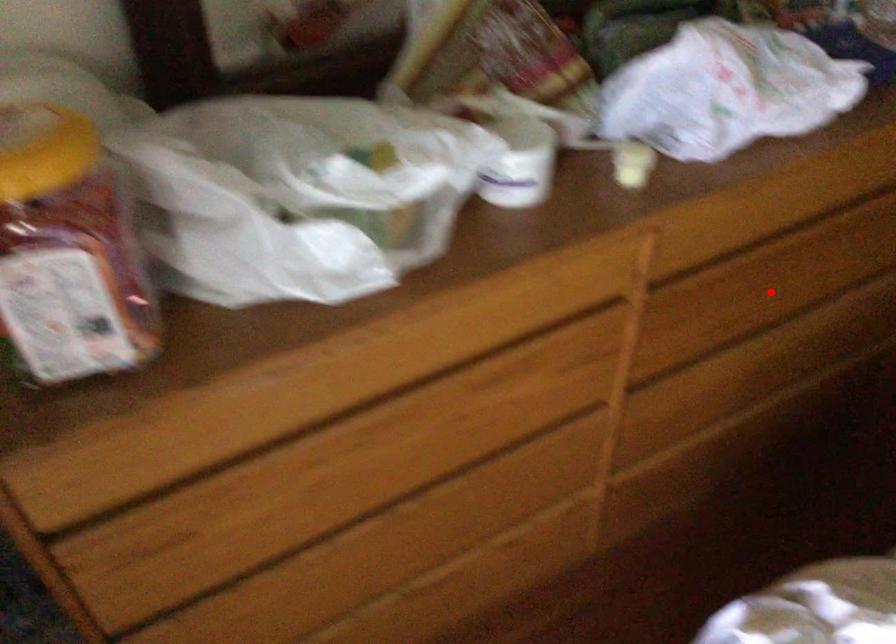
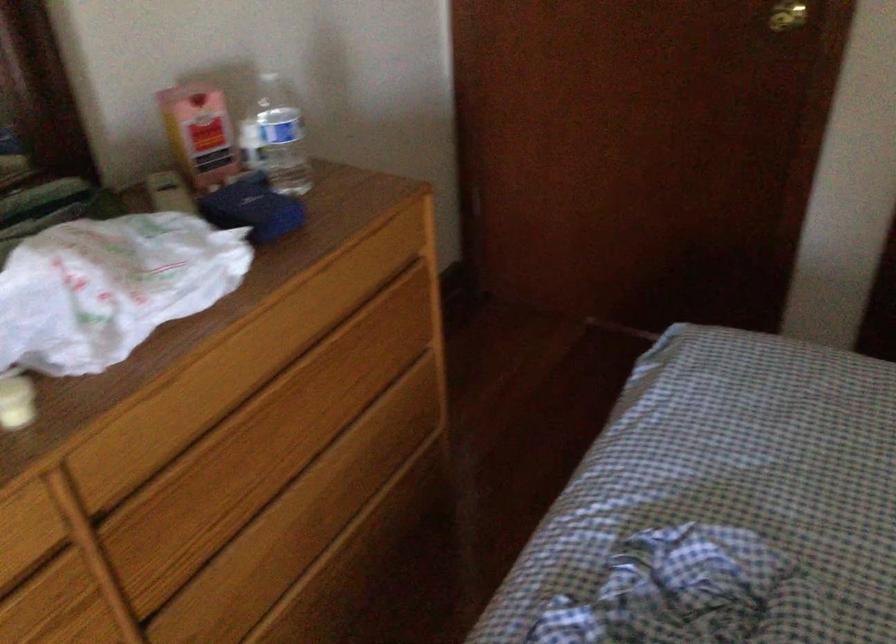
The point at the highlighted location is marked in the first image. Where is the corresponding point in the second image?

(263, 456)